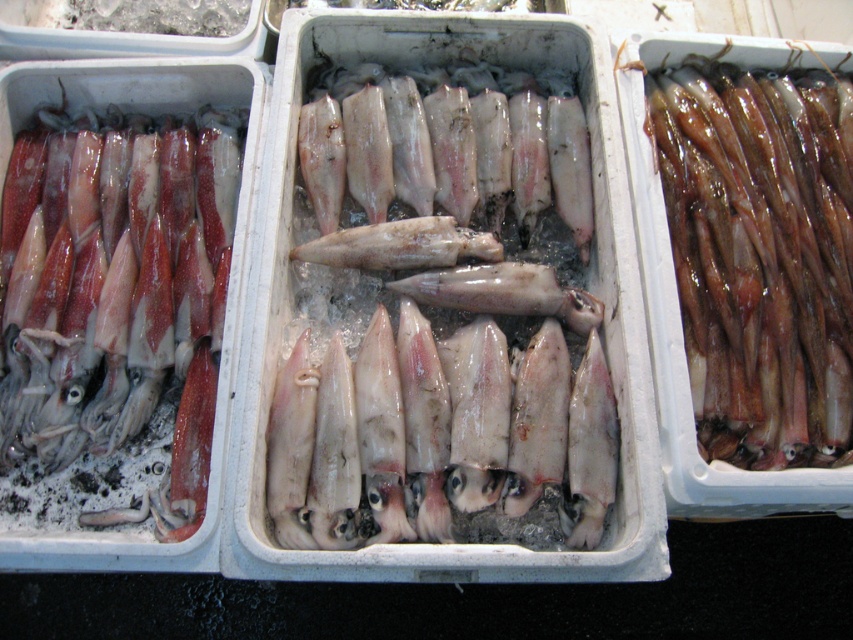
Question: Is pale white glossy squid at center wider than glistening wet squid at center?

Choices:
 (A) yes
 (B) no

Answer: (A)

Question: In this image, where is pale white glossy squid at center located relative to matte red squid at left?

Choices:
 (A) below
 (B) above

Answer: (B)

Question: Is pale white glossy squid at center thinner than glistening wet squid at center?

Choices:
 (A) yes
 (B) no

Answer: (B)

Question: Which of these objects is positioned farthest from the matte red squid at left?

Choices:
 (A) glistening wet squid at center
 (B) pale white glossy squid at center

Answer: (A)

Question: Which point is closer to the camera?

Choices:
 (A) matte red squid at left
 (B) pale white glossy squid at center
 (C) glistening wet squid at center

Answer: (B)

Question: Estimate the real-world distances between objects in this image. Which object is closer to the pale white glossy squid at center?

Choices:
 (A) glistening wet squid at center
 (B) matte red squid at left

Answer: (B)